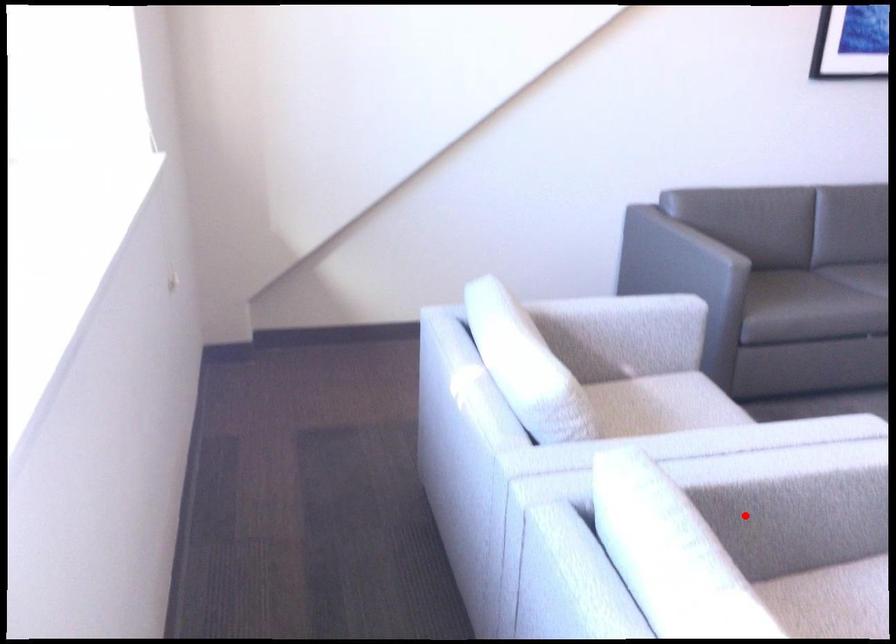
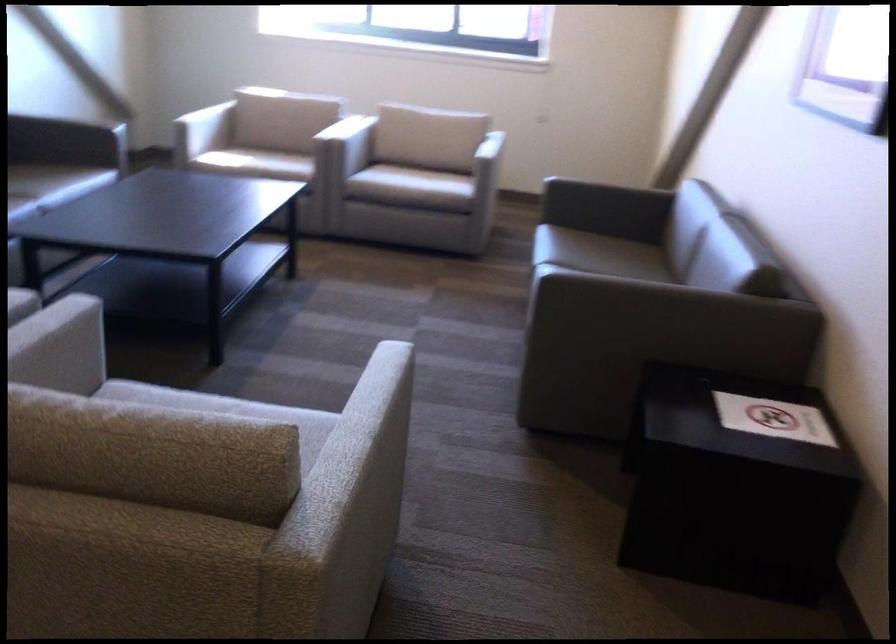
Question: I am providing you with two images of the same scene from different viewpoints. Given a red point in image1, look at the same physical point in image2. Is it:

Choices:
 (A) Closer to the viewpoint
 (B) Farther from the viewpoint

Answer: (B)